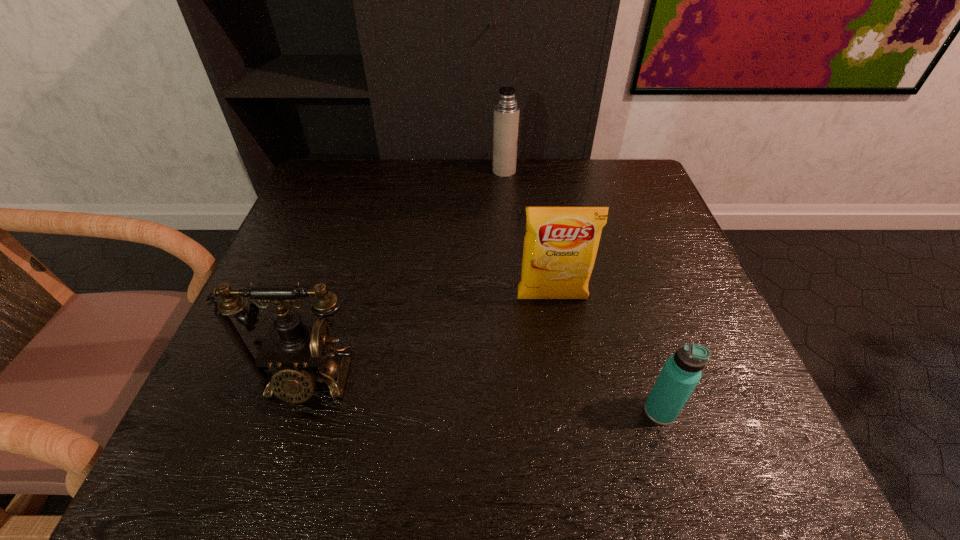
Find the location of a particular element. This screenshot has width=960, height=540. vacant point at the near right corner is located at coordinates (680, 425).

I want to click on free point between the shortest object and the second farthest object, so click(x=606, y=355).

In order to click on empty space between the nearer thermos bottle and the second farthest object in this screenshot , I will do `click(606, 355)`.

This screenshot has height=540, width=960. In order to click on free space between the leftmost object and the farthest object in this screenshot , I will do `click(405, 275)`.

Locate an element on the screen. This screenshot has height=540, width=960. free area in between the right thermos bottle and the crisp (potato chip) is located at coordinates (606, 355).

Where is `vacant space that's between the third nearest object and the shorter thermos bottle`? The width and height of the screenshot is (960, 540). vacant space that's between the third nearest object and the shorter thermos bottle is located at coordinates point(606,355).

Select which object is the second closest to the leftmost object. Please provide its 2D coordinates. Your answer should be formatted as a tuple, i.e. [(x, y)], where the tuple contains the x and y coordinates of a point satisfying the conditions above.

[(681, 372)]

The height and width of the screenshot is (540, 960). I want to click on object that can be found as the second closest to the leftmost object, so click(681, 372).

This screenshot has width=960, height=540. Identify the location of free region that satisfies the following two spatial constraints: 1. on the front of the shorter thermos bottle with the logo; 2. on the right side of the crisp (potato chip). (569, 411).

Locate an element on the screen. This screenshot has width=960, height=540. free space that satisfies the following two spatial constraints: 1. on the front of the second farthest object with the logo; 2. on the right side of the shorter thermos bottle is located at coordinates (569, 411).